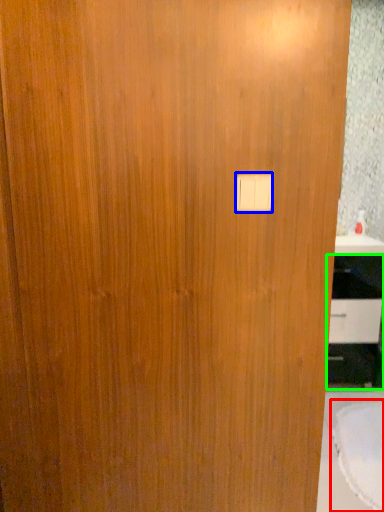
Question: Which object is positioned closest to round table (highlighted by a red box)? Select from light switch (highlighted by a blue box) and cabinetry (highlighted by a green box).

Choices:
 (A) light switch
 (B) cabinetry

Answer: (B)